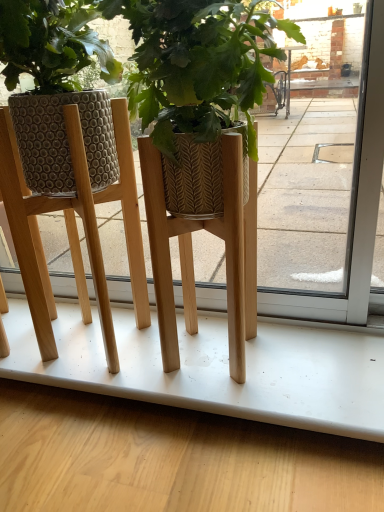
Question: Should I look upward or downward to see wooden planter at center?

Choices:
 (A) down
 (B) up

Answer: (B)

Question: Is wooden planter at center positioned far away from wooden floor at lower center?

Choices:
 (A) no
 (B) yes

Answer: (A)

Question: Is wooden planter at center wider than wooden floor at lower center?

Choices:
 (A) yes
 (B) no

Answer: (A)

Question: Is wooden planter at center taller than wooden floor at lower center?

Choices:
 (A) yes
 (B) no

Answer: (A)

Question: From a real-world perspective, is wooden planter at center on top of wooden floor at lower center?

Choices:
 (A) no
 (B) yes

Answer: (B)

Question: Considering the relative sizes of wooden planter at center and wooden floor at lower center in the image provided, is wooden planter at center bigger than wooden floor at lower center?

Choices:
 (A) yes
 (B) no

Answer: (B)

Question: Is wooden planter at center not inside wooden floor at lower center?

Choices:
 (A) yes
 (B) no

Answer: (A)

Question: Is wooden floor at lower center positioned in front of wooden planter at center?

Choices:
 (A) no
 (B) yes

Answer: (A)

Question: Is wooden floor at lower center further to the viewer compared to wooden planter at center?

Choices:
 (A) yes
 (B) no

Answer: (A)

Question: Does wooden floor at lower center have a lesser height compared to wooden planter at center?

Choices:
 (A) yes
 (B) no

Answer: (A)

Question: From a real-world perspective, is wooden floor at lower center beneath wooden planter at center?

Choices:
 (A) no
 (B) yes

Answer: (B)

Question: Does wooden floor at lower center have a smaller size compared to wooden planter at center?

Choices:
 (A) yes
 (B) no

Answer: (B)

Question: Does wooden floor at lower center turn towards wooden planter at center?

Choices:
 (A) no
 (B) yes

Answer: (A)

Question: Relative to wooden planter at center, is wooden floor at lower center in front or behind?

Choices:
 (A) behind
 (B) front

Answer: (A)